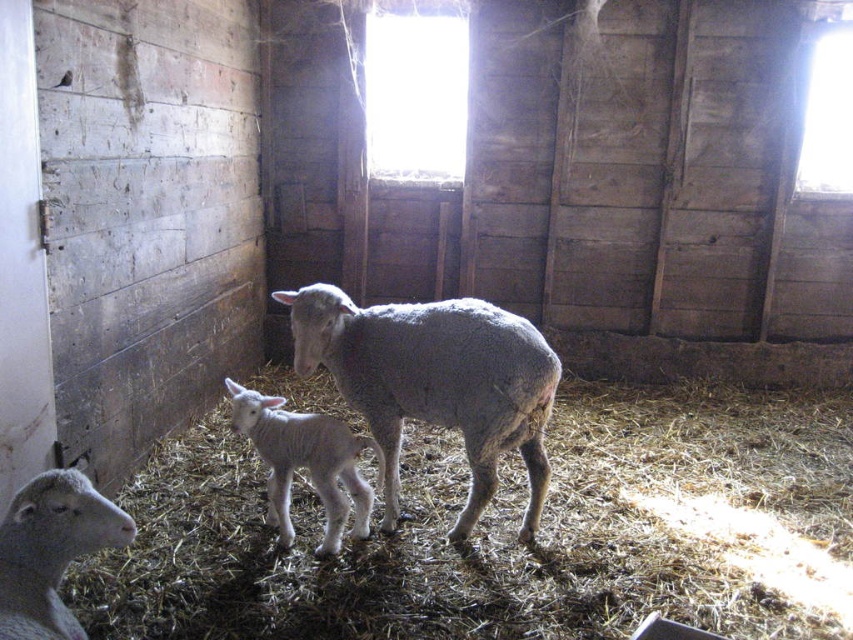
Question: Is gray woolen sheep at center above gray woolen sheep at lower left?

Choices:
 (A) no
 (B) yes

Answer: (B)

Question: Which of these objects is positioned closest to the gray woolen sheep at center?

Choices:
 (A) fuzzy straw at lower left
 (B) gray woolen sheep at lower left

Answer: (A)

Question: Which of the following is the closest to the observer?

Choices:
 (A) (39, 502)
 (B) (231, 401)
 (C) (184, 595)

Answer: (A)

Question: Is fuzzy straw at lower left wider than gray woolen sheep at center?

Choices:
 (A) no
 (B) yes

Answer: (B)

Question: Is gray woolen sheep at lower left further to camera compared to white woolen lamb at center?

Choices:
 (A) no
 (B) yes

Answer: (A)

Question: Among these points, which one is nearest to the camera?

Choices:
 (A) (54, 592)
 (B) (405, 413)
 (C) (323, 490)
 (D) (627, 486)

Answer: (A)